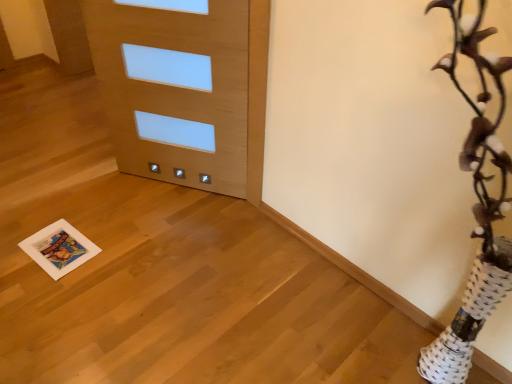
Question: In terms of height, does light wood door at center look taller or shorter compared to white paper print at lower left?

Choices:
 (A) short
 (B) tall

Answer: (B)

Question: Considering their positions, is light wood door at center located in front of or behind white paper print at lower left?

Choices:
 (A) behind
 (B) front

Answer: (B)

Question: Considering the positions of light wood door at center and white paper print at lower left in the image, is light wood door at center wider or thinner than white paper print at lower left?

Choices:
 (A) wide
 (B) thin

Answer: (B)

Question: From the image's perspective, relative to light wood door at center, is white paper print at lower left above or below?

Choices:
 (A) above
 (B) below

Answer: (B)

Question: Is point (53, 230) closer or farther from the camera than point (212, 86)?

Choices:
 (A) closer
 (B) farther

Answer: (B)

Question: Choose the correct answer: Is white paper print at lower left inside light wood door at center or outside it?

Choices:
 (A) inside
 (B) outside

Answer: (B)

Question: Considering the positions of white paper print at lower left and light wood door at center in the image, is white paper print at lower left wider or thinner than light wood door at center?

Choices:
 (A) thin
 (B) wide

Answer: (B)